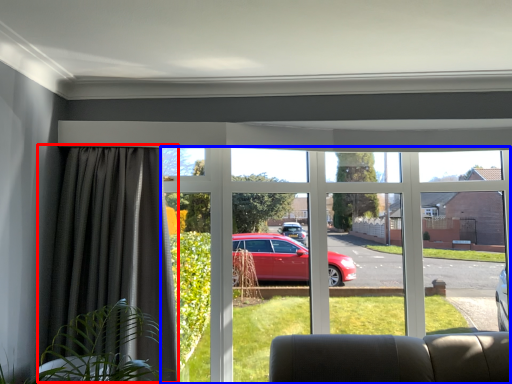
Question: Among these objects, which one is farthest to the camera, curtain (highlighted by a red box) or window (highlighted by a blue box)?

Choices:
 (A) curtain
 (B) window

Answer: (B)